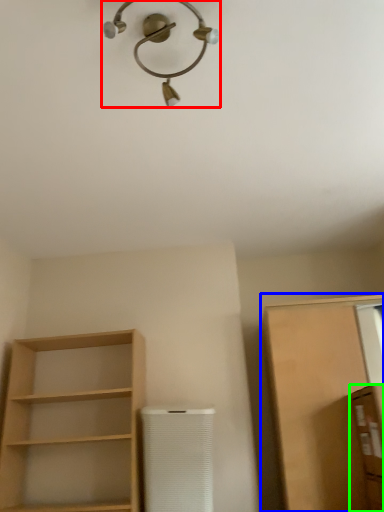
Question: Considering the real-world distances, which object is farthest from light fixture (highlighted by a red box)? cabinetry (highlighted by a blue box) or cabinetry (highlighted by a green box)?

Choices:
 (A) cabinetry
 (B) cabinetry

Answer: (B)